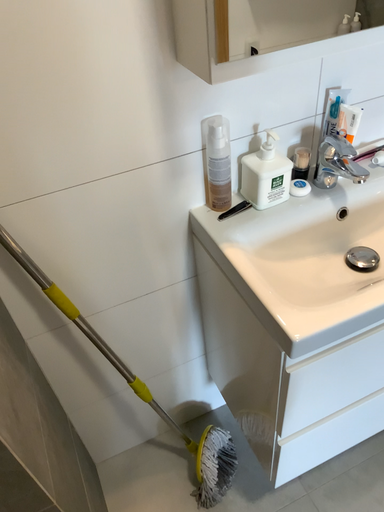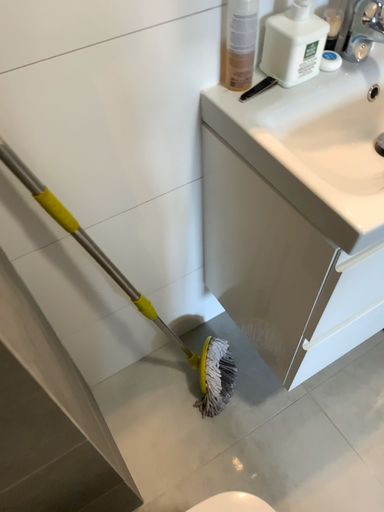
Question: Which way did the camera rotate in the video?

Choices:
 (A) rotated right
 (B) rotated left

Answer: (A)